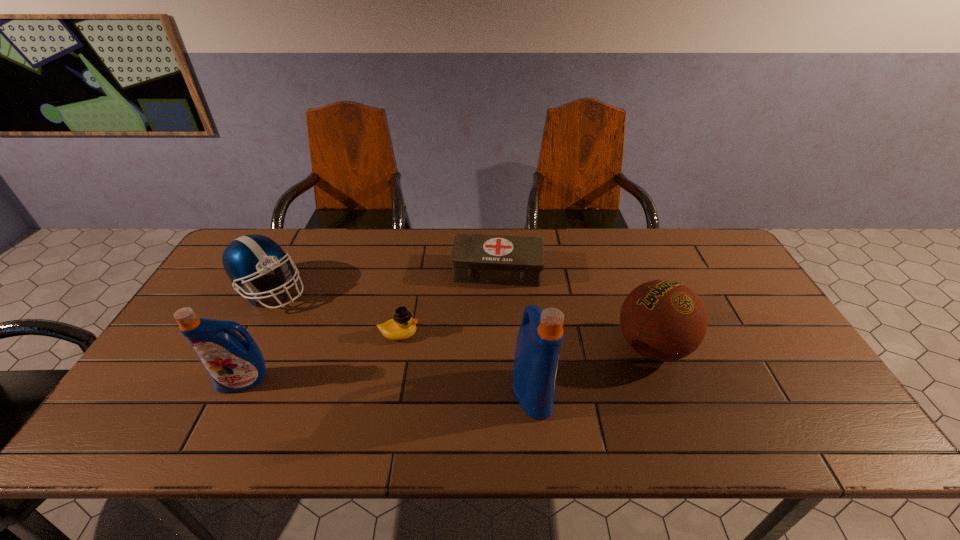
Identify the location of vacant region between the first-aid kit and the fourth tallest object. The width and height of the screenshot is (960, 540). coord(384,280).

You are a GUI agent. You are given a task and a screenshot of the screen. Output one action in this format:
    pyautogui.click(x=<x>, y=<y>)
    Task: Click on the free space between the duck and the tallest object
    This screenshot has width=960, height=540.
    Given the screenshot: What is the action you would take?
    pyautogui.click(x=466, y=363)

Locate an element on the screen. object that stands as the fourth closest to the duck is located at coordinates (234, 364).

The height and width of the screenshot is (540, 960). I want to click on the second closest object to the basketball, so click(480, 259).

Find the location of `vacant region that satisfies the following two spatial constraints: 1. at the front of the rightmost object with the faceguard; 2. on the right side of the football helmet`. vacant region that satisfies the following two spatial constraints: 1. at the front of the rightmost object with the faceguard; 2. on the right side of the football helmet is located at coordinates (241, 347).

The width and height of the screenshot is (960, 540). Identify the location of blank space that satisfies the following two spatial constraints: 1. on the front-facing side of the rightmost object; 2. on the left side of the duck. (396, 347).

This screenshot has height=540, width=960. Find the location of `vacant space that satisfies the following two spatial constraints: 1. on the front-facing side of the basketball; 2. on the right side of the duck`. vacant space that satisfies the following two spatial constraints: 1. on the front-facing side of the basketball; 2. on the right side of the duck is located at coordinates (396, 347).

Identify the location of blank space that satisfies the following two spatial constraints: 1. on the front side of the first-aid kit; 2. on the front-facing side of the duck. (500, 334).